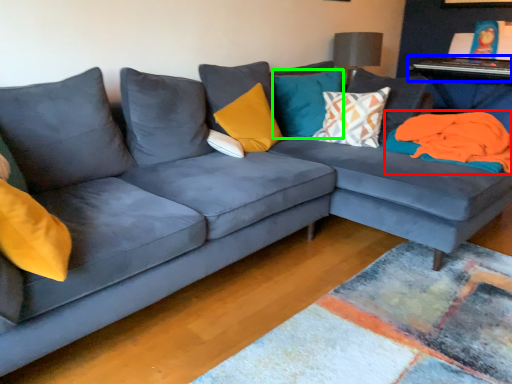
Question: Considering the real-world distances, which object is farthest from material (highlighted by a red box)? table (highlighted by a blue box) or pillow (highlighted by a green box)?

Choices:
 (A) table
 (B) pillow

Answer: (A)